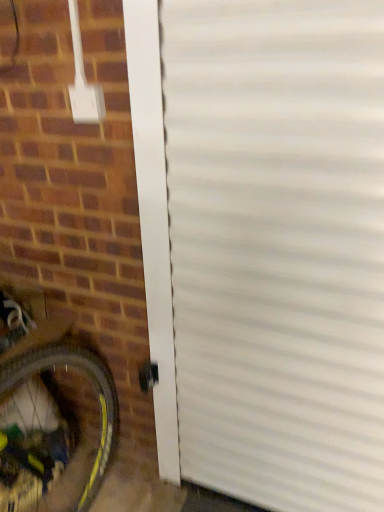
Question: Is white corrugated door at center directly adjacent to yellow rubber bicycle wheel at lower left?

Choices:
 (A) no
 (B) yes

Answer: (A)

Question: Considering the relative positions of white corrugated door at center and yellow rubber bicycle wheel at lower left in the image provided, is white corrugated door at center to the left of yellow rubber bicycle wheel at lower left from the viewer's perspective?

Choices:
 (A) yes
 (B) no

Answer: (B)

Question: Is white corrugated door at center smaller than yellow rubber bicycle wheel at lower left?

Choices:
 (A) yes
 (B) no

Answer: (A)

Question: Is white corrugated door at center surrounding yellow rubber bicycle wheel at lower left?

Choices:
 (A) no
 (B) yes

Answer: (A)

Question: Would you say white corrugated door at center is outside yellow rubber bicycle wheel at lower left?

Choices:
 (A) no
 (B) yes

Answer: (B)

Question: Does white corrugated door at center have a greater width compared to yellow rubber bicycle wheel at lower left?

Choices:
 (A) no
 (B) yes

Answer: (A)

Question: Considering the relative sizes of yellow rubber bicycle wheel at lower left and brown brick at lower left in the image provided, is yellow rubber bicycle wheel at lower left bigger than brown brick at lower left?

Choices:
 (A) yes
 (B) no

Answer: (B)

Question: Is yellow rubber bicycle wheel at lower left smaller than brown brick at lower left?

Choices:
 (A) no
 (B) yes

Answer: (B)

Question: From the image's perspective, is yellow rubber bicycle wheel at lower left over brown brick at lower left?

Choices:
 (A) no
 (B) yes

Answer: (A)

Question: Would you say yellow rubber bicycle wheel at lower left is a long distance from brown brick at lower left?

Choices:
 (A) yes
 (B) no

Answer: (B)

Question: Is yellow rubber bicycle wheel at lower left positioned beyond the bounds of brown brick at lower left?

Choices:
 (A) no
 (B) yes

Answer: (A)

Question: Can you confirm if yellow rubber bicycle wheel at lower left is positioned to the right of brown brick at lower left?

Choices:
 (A) yes
 (B) no

Answer: (B)

Question: Considering the relative sizes of brown brick at lower left and white corrugated door at center in the image provided, is brown brick at lower left thinner than white corrugated door at center?

Choices:
 (A) yes
 (B) no

Answer: (B)